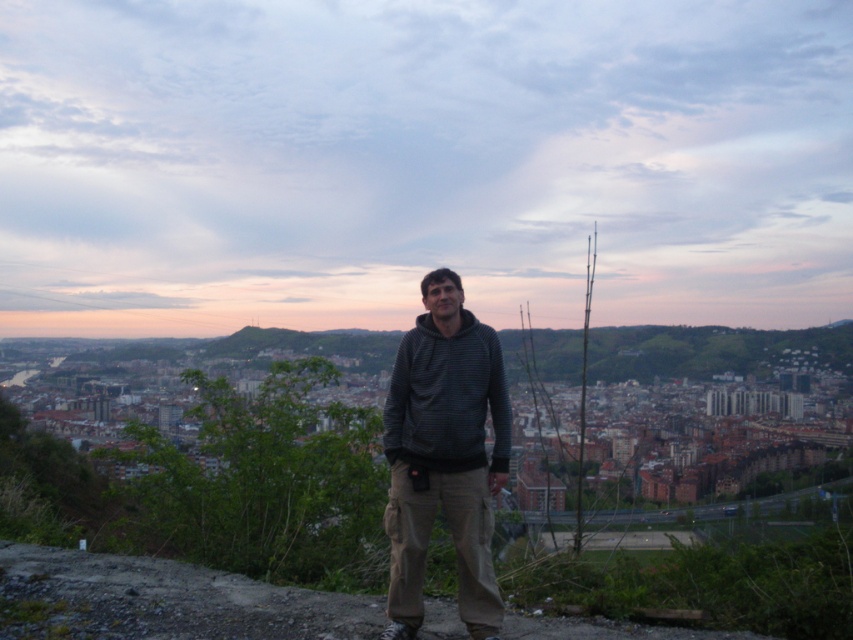
Question: Which object is farther from the camera taking this photo?

Choices:
 (A) dark gray striped hoodie at center
 (B) dark gray hoodie at center

Answer: (A)

Question: Does dark gray hoodie at center have a larger size compared to dark gray striped hoodie at center?

Choices:
 (A) yes
 (B) no

Answer: (A)

Question: Is dark gray hoodie at center bigger than dark gray striped hoodie at center?

Choices:
 (A) no
 (B) yes

Answer: (B)

Question: Which point is closer to the camera taking this photo?

Choices:
 (A) (422, 305)
 (B) (497, 390)

Answer: (B)

Question: Is dark gray hoodie at center positioned before dark gray striped hoodie at center?

Choices:
 (A) no
 (B) yes

Answer: (B)

Question: Among these points, which one is farthest from the camera?

Choices:
 (A) (459, 289)
 (B) (421, 426)

Answer: (A)